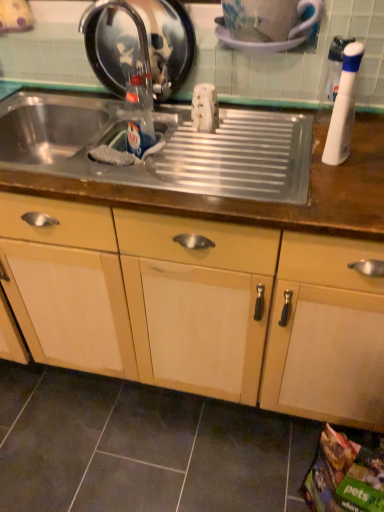
At what (x,y) coordinates should I click in order to perform the action: click on vacant area located to the right-hand side of white plastic bottle at right, which appears as the 2th bottle when viewed from the back. Please return your answer as a coordinate pair (x, y). Image resolution: width=384 pixels, height=512 pixels. Looking at the image, I should click on (366, 153).